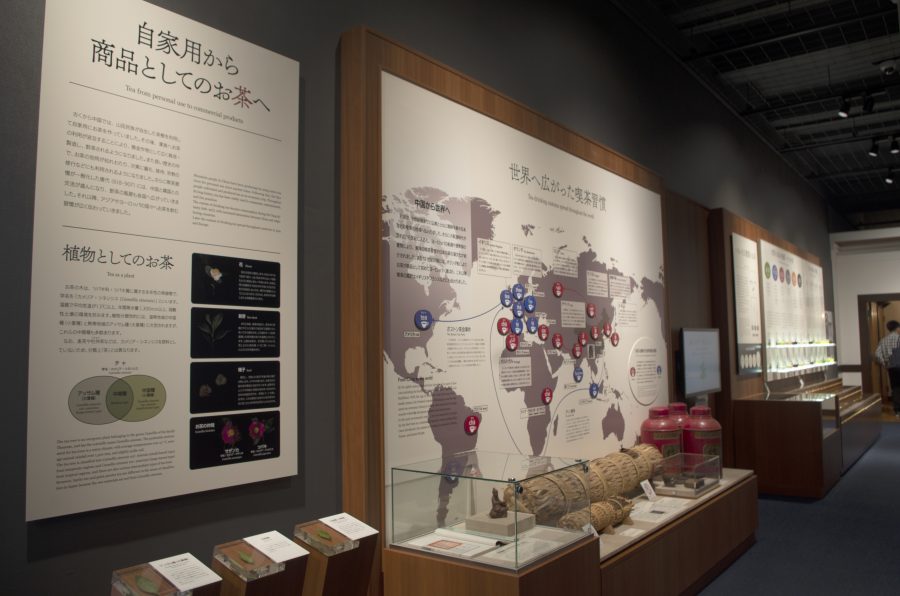
Find the location of a particular element. The height and width of the screenshot is (596, 900). display is located at coordinates (583, 493), (706, 445), (666, 449).